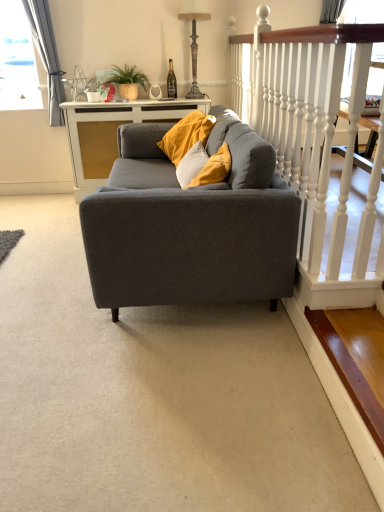
I want to click on free space above wooden stair at lower right (from a real-world perspective), so click(x=357, y=343).